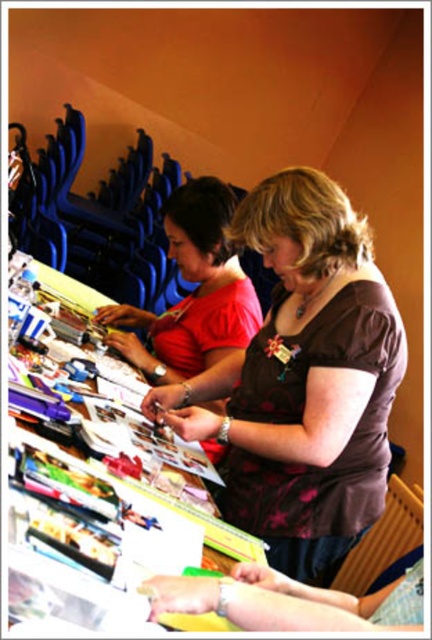
You are organizing a craft event and need to place a large box on the table. The box is wider than the wooden table at center. Can the brown textured blouse at center be moved to accommodate the box?

The brown textured blouse at center is wider than the wooden table at center, so moving it might create space for the large box.